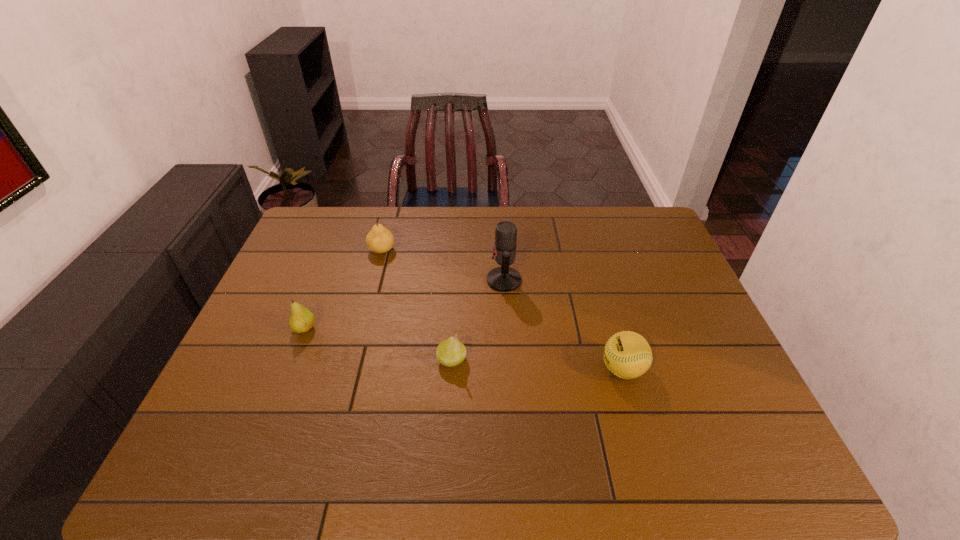
Locate an element on the screen. The height and width of the screenshot is (540, 960). the tallest object is located at coordinates (504, 279).

Find the location of a particular element. microphone is located at coordinates (504, 279).

Identify the location of the second object from left to right. (379, 240).

Where is `the farthest object`? Image resolution: width=960 pixels, height=540 pixels. the farthest object is located at coordinates (379, 240).

Image resolution: width=960 pixels, height=540 pixels. In order to click on the leftmost object in this screenshot , I will do `click(301, 320)`.

This screenshot has width=960, height=540. Find the location of `the leftmost pear`. the leftmost pear is located at coordinates (301, 320).

This screenshot has width=960, height=540. What are the coordinates of `the third object from left to right` in the screenshot? It's located at (451, 352).

Locate an element on the screen. the rightmost pear is located at coordinates (451, 352).

The height and width of the screenshot is (540, 960). What are the coordinates of `the rightmost object` in the screenshot? It's located at (627, 354).

Locate an element on the screen. The image size is (960, 540). vacant area located 0.200m on the side of the microphone with the red ring is located at coordinates tap(421, 280).